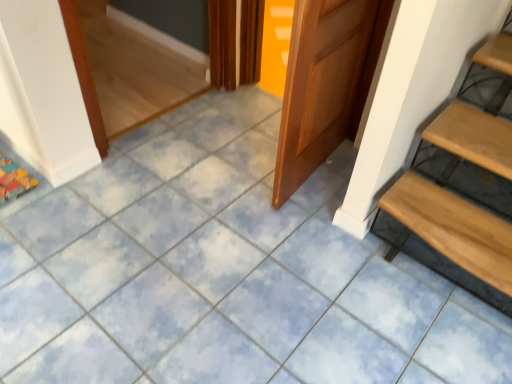
Question: Considering the positions of wooden door at center and light brown wooden stairs at lower right in the image, is wooden door at center taller or shorter than light brown wooden stairs at lower right?

Choices:
 (A) tall
 (B) short

Answer: (A)

Question: Considering the positions of point (359, 81) and point (501, 236), is point (359, 81) closer or farther from the camera than point (501, 236)?

Choices:
 (A) closer
 (B) farther

Answer: (B)

Question: Would you say wooden door at center is to the left or to the right of light brown wooden stairs at lower right in the picture?

Choices:
 (A) right
 (B) left

Answer: (B)

Question: Considering the positions of light brown wooden stairs at lower right and wooden door at center in the image, is light brown wooden stairs at lower right bigger or smaller than wooden door at center?

Choices:
 (A) big
 (B) small

Answer: (A)

Question: Considering the positions of point (492, 301) and point (315, 6), is point (492, 301) closer or farther from the camera than point (315, 6)?

Choices:
 (A) closer
 (B) farther

Answer: (B)

Question: From the image's perspective, is light brown wooden stairs at lower right located above or below wooden door at center?

Choices:
 (A) above
 (B) below

Answer: (B)

Question: Is light brown wooden stairs at lower right inside or outside of wooden door at center?

Choices:
 (A) outside
 (B) inside

Answer: (A)